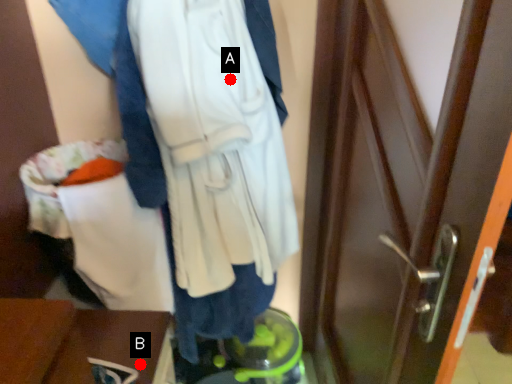
Question: Two points are circled on the image, labeled by A and B beside each circle. Which point is farther to the camera?

Choices:
 (A) A is further
 (B) B is further

Answer: (A)